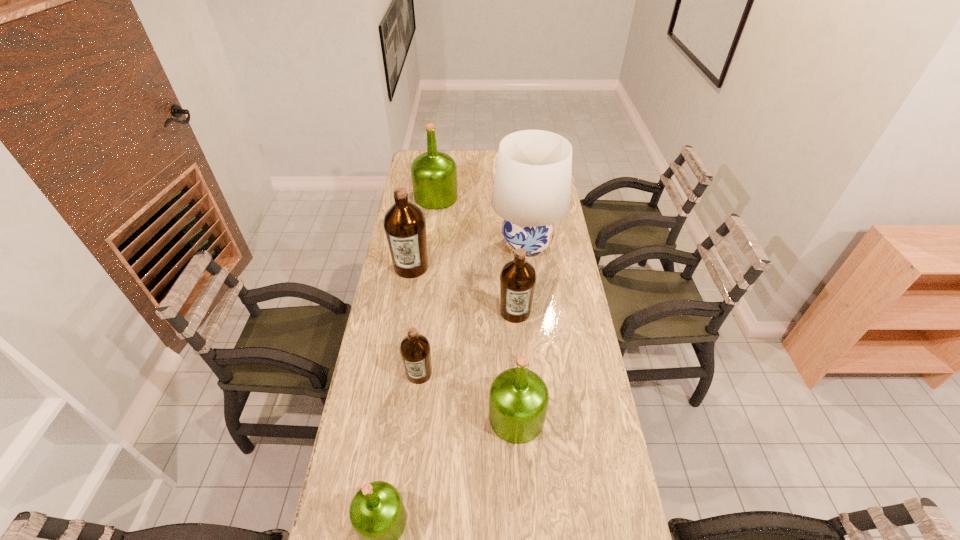
Choose which object is the sixth nearest neighbor to the second nearest olive oil. Please provide its 2D coordinates. Your answer should be formatted as a tuple, i.e. [(x, y)], where the tuple contains the x and y coordinates of a point satisfying the conditions above.

[(434, 174)]

Select which olive oil is the closest to the second nearest olive oil. Please provide its 2D coordinates. Your answer should be formatted as a tuple, i.e. [(x, y)], where the tuple contains the x and y coordinates of a point satisfying the conditions above.

[(415, 350)]

Where is `olive oil identified as the third closest to the fourth nearest object`? The width and height of the screenshot is (960, 540). olive oil identified as the third closest to the fourth nearest object is located at coordinates (404, 223).

At what (x,y) coordinates should I click in order to perform the action: click on brown olive oil that is the third closest one to the nearest green olive oil. Please return your answer as a coordinate pair (x, y). Looking at the image, I should click on (404, 223).

Point out which brown olive oil is positioned as the nearest to the blue lampshade. Please provide its 2D coordinates. Your answer should be formatted as a tuple, i.e. [(x, y)], where the tuple contains the x and y coordinates of a point satisfying the conditions above.

[(518, 277)]

This screenshot has width=960, height=540. Identify the location of green olive oil object that ranks as the closest to the blue lampshade. (434, 174).

Identify which green olive oil is the nearest to the fifth nearest olive oil. Please provide its 2D coordinates. Your answer should be formatted as a tuple, i.e. [(x, y)], where the tuple contains the x and y coordinates of a point satisfying the conditions above.

[(434, 174)]

Find the location of a particular element. This screenshot has height=540, width=960. vacant space that satisfies the following two spatial constraints: 1. on the label of the fifth farthest olive oil; 2. on the left side of the biggest brown olive oil is located at coordinates (387, 417).

Where is `free region that satisfies the following two spatial constraints: 1. on the label of the fifth farthest olive oil; 2. on the right side of the third nearest olive oil`? free region that satisfies the following two spatial constraints: 1. on the label of the fifth farthest olive oil; 2. on the right side of the third nearest olive oil is located at coordinates (415, 417).

Find the location of a particular element. This screenshot has height=540, width=960. vacant area that satisfies the following two spatial constraints: 1. on the label of the second farthest green olive oil; 2. on the right side of the nearest brown olive oil is located at coordinates (415, 417).